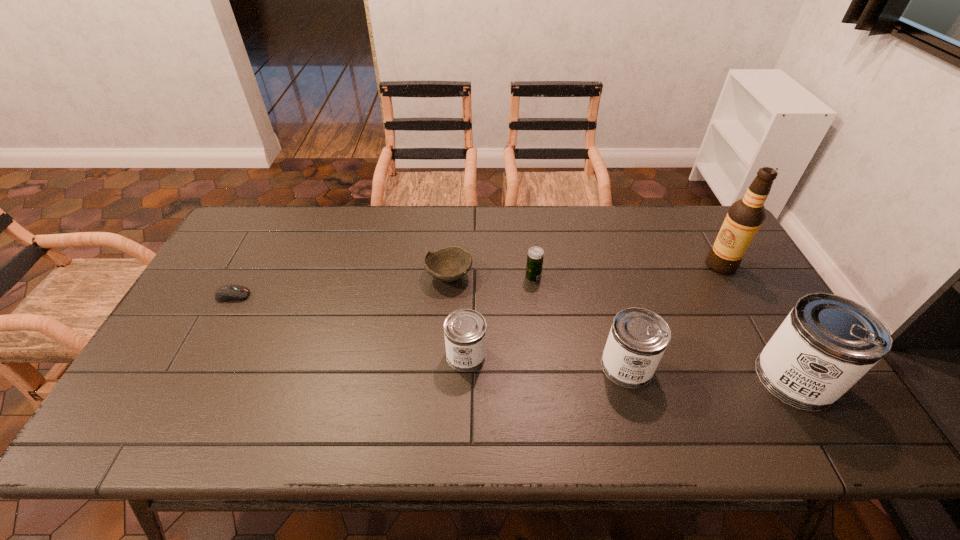
Identify the location of can that is at the right edge. This screenshot has width=960, height=540. click(827, 343).

Find the location of a particular element. The height and width of the screenshot is (540, 960). alcohol located at the right edge is located at coordinates (745, 216).

The image size is (960, 540). Find the location of `object at the near right corner`. object at the near right corner is located at coordinates (827, 343).

This screenshot has height=540, width=960. What are the coordinates of `free space at the far edge of the desktop` in the screenshot? It's located at (564, 220).

In order to click on free space at the near edge of the desktop in this screenshot , I will do `click(753, 393)`.

What are the coordinates of `free location at the near left corner` in the screenshot? It's located at (153, 390).

Locate an element on the screen. The height and width of the screenshot is (540, 960). vacant space at the far right corner of the desktop is located at coordinates (708, 228).

Where is `vacant area that lies between the fifth shortest object and the bowl`? The image size is (960, 540). vacant area that lies between the fifth shortest object and the bowl is located at coordinates (538, 321).

Image resolution: width=960 pixels, height=540 pixels. I want to click on blank region between the shortest object and the tallest object, so click(x=477, y=280).

Find the location of a particular element. free area in between the sixth tallest object and the fifth object from left to right is located at coordinates (538, 321).